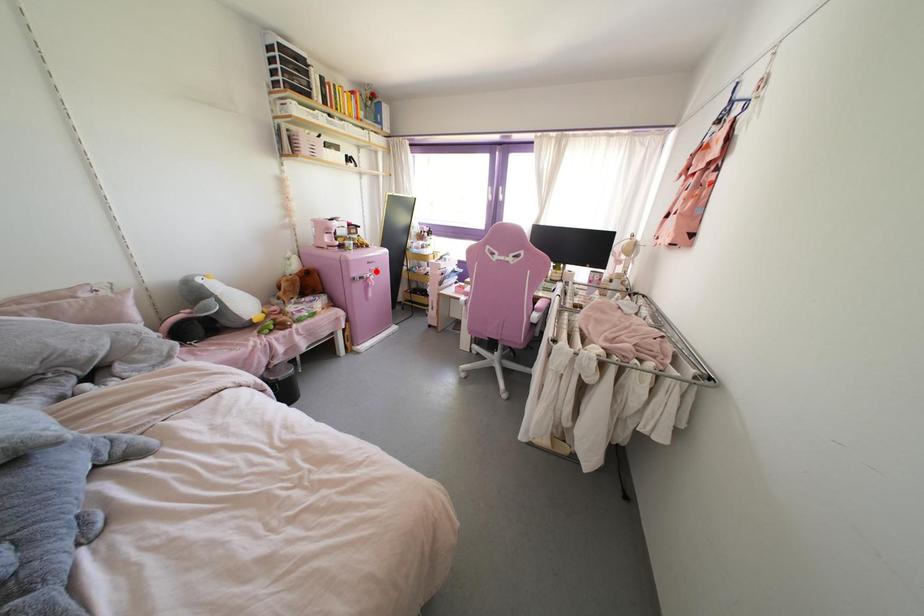
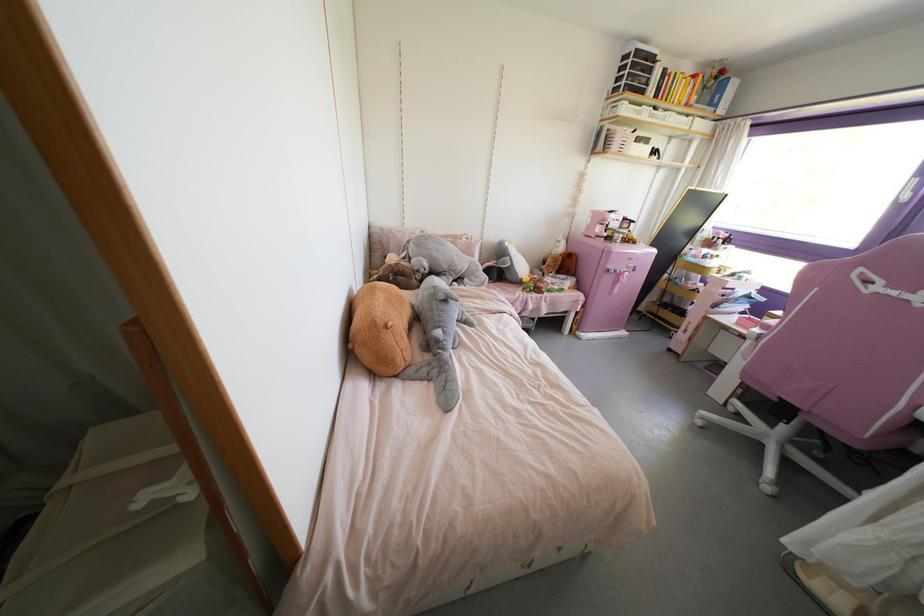
In the second image, find the point that corresponds to the highlighted location in the first image.

(633, 270)